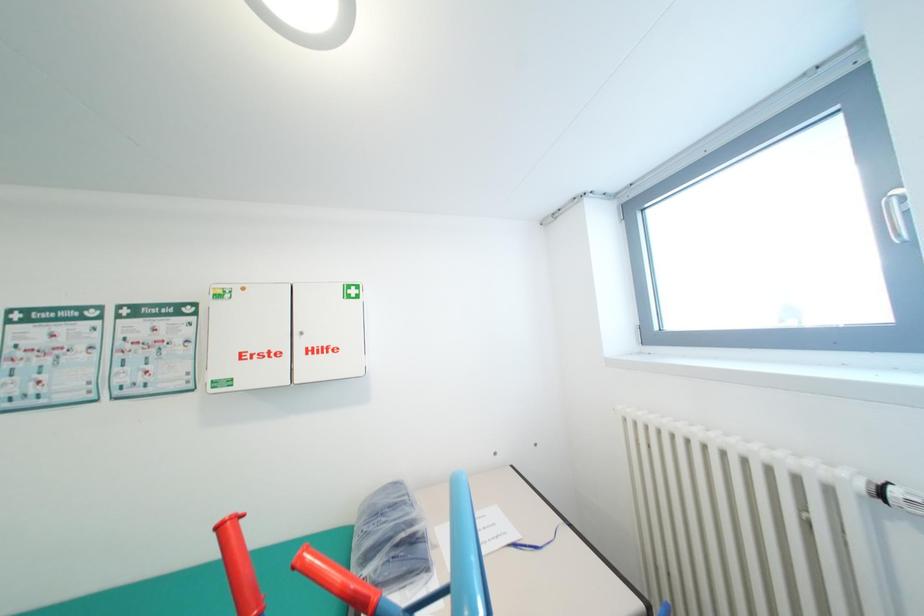
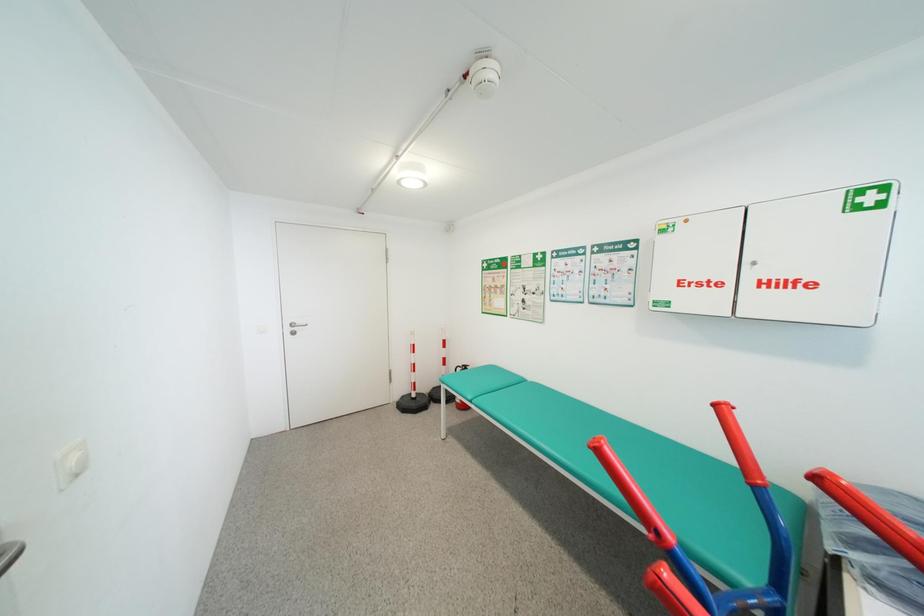
Question: The camera is either moving clockwise (left) or counter-clockwise (right) around the object. The first image is from the beginning of the video and the second image is from the end. Is the camera moving left or right when shooting the video?

Choices:
 (A) Left
 (B) Right

Answer: (B)